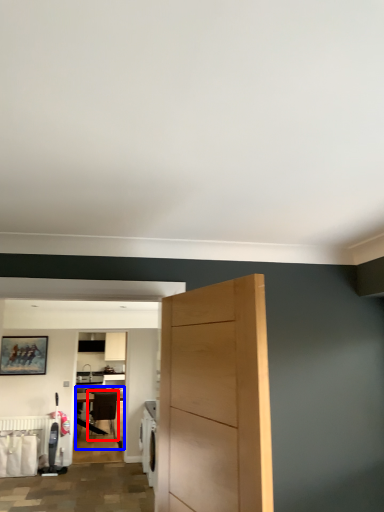
Question: Which point is further to the camera, chair (highlighted by a red box) or table (highlighted by a blue box)?

Choices:
 (A) chair
 (B) table

Answer: (B)